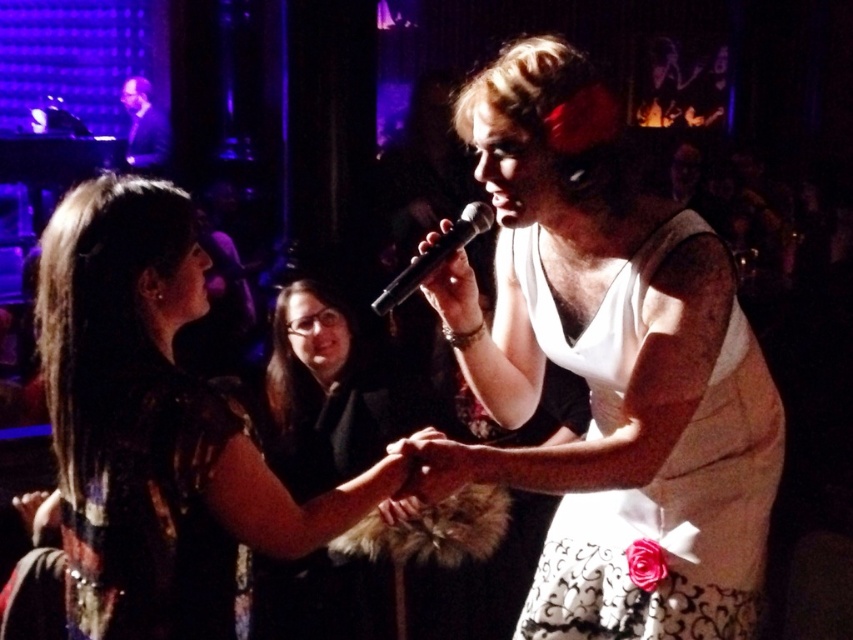
You are organizing a photo shoot and need to ensure that the black sequined dress at center and the black plastic microphone at center are both visible in the frame. Based on their sizes, which object should you prioritize positioning closer to the camera to ensure visibility?

The black sequined dress at center might be wider than the black plastic microphone at center, so you should prioritize positioning the black plastic microphone at center closer to the camera to ensure visibility.

You are a photographer at the event and want to capture a photo where both the black matte dress at center and the dark suit at upper left are visible. Which object should be placed closer to the camera to ensure both are in focus?

The black matte dress at center is taller than the dark suit at upper left. To ensure both are in focus, place the black matte dress at center closer to the camera since its greater height would require it to be positioned where the depth of field can accommodate both subjects.